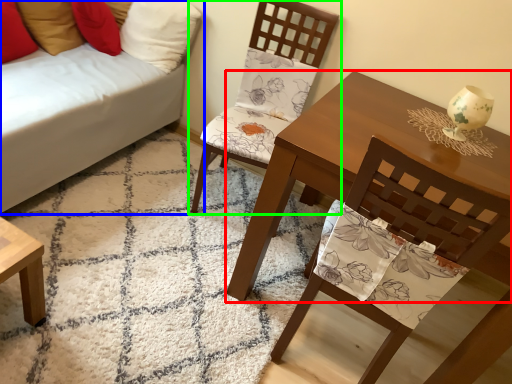
Question: Which is farther away from table (highlighted by a red box)? studio couch (highlighted by a blue box) or chair (highlighted by a green box)?

Choices:
 (A) studio couch
 (B) chair

Answer: (A)